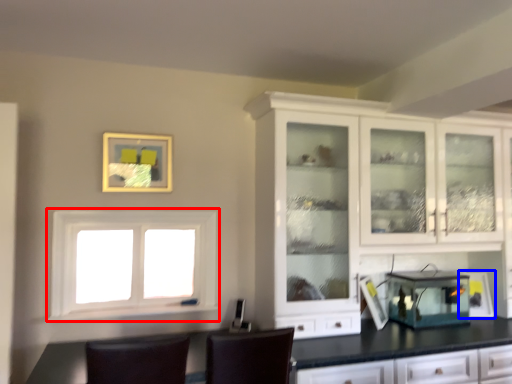
Question: Which of the following is the farthest to the observer, window (highlighted by a red box) or appliance (highlighted by a blue box)?

Choices:
 (A) window
 (B) appliance

Answer: (B)